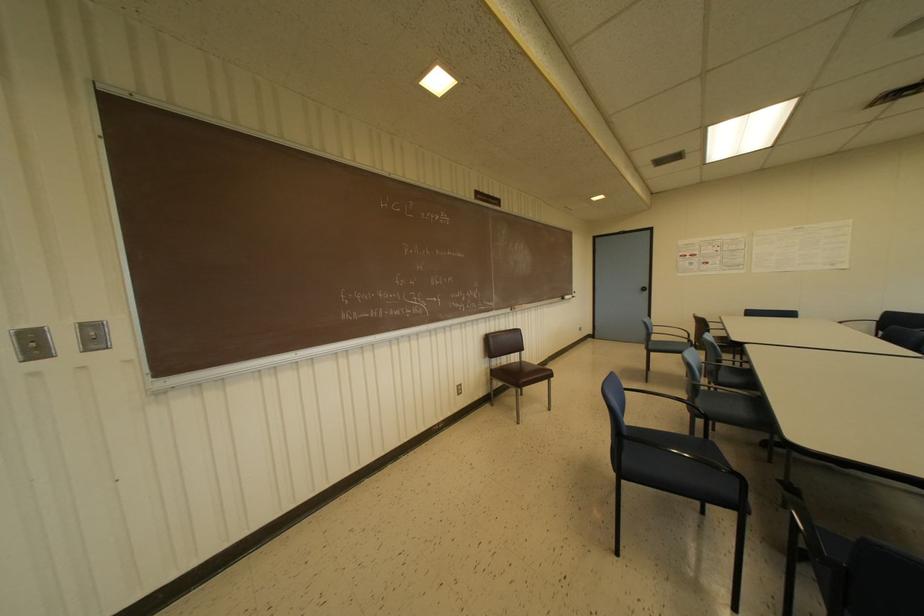
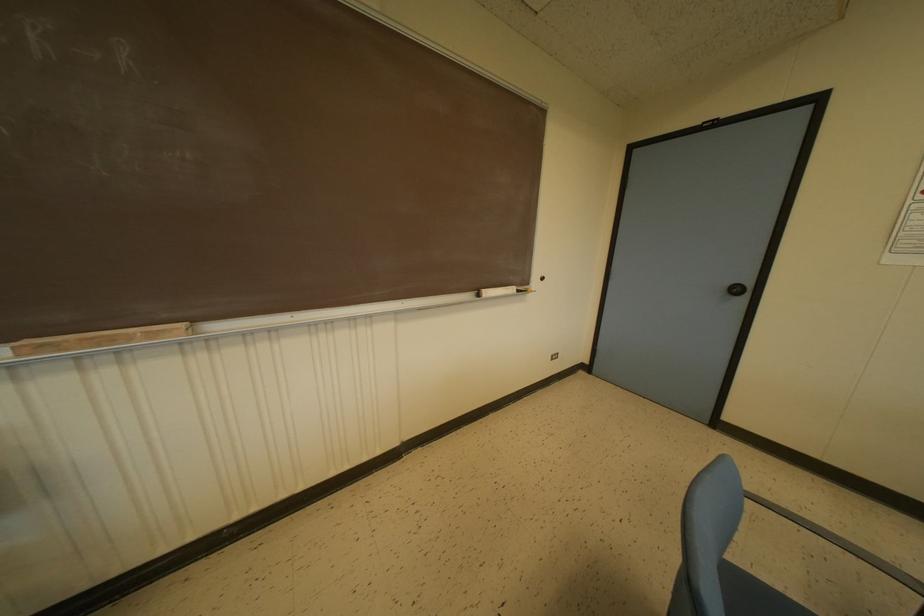
Where in the second image is the point corresponding to point 565,296 from the first image?

(487, 292)